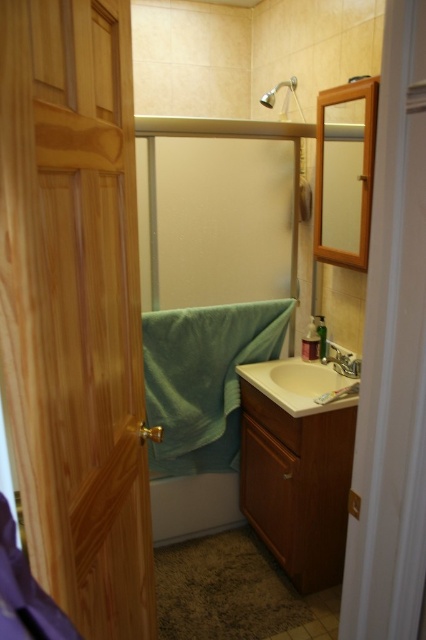
Can you confirm if green cotton towel at center is positioned below beige matte sink at center?

No, green cotton towel at center is not below beige matte sink at center.

Locate an element on the screen. The width and height of the screenshot is (426, 640). green cotton towel at center is located at coordinates (204, 380).

Is wooden framed mirror at upper right closer to camera compared to matte silver faucet at sink right?

Yes, it is in front of matte silver faucet at sink right.

Which of these two, wooden framed mirror at upper right or matte silver faucet at sink right, stands shorter?

Standing shorter between the two is matte silver faucet at sink right.

This screenshot has width=426, height=640. I want to click on wooden framed mirror at upper right, so click(345, 172).

Does point (144, 321) come farther from viewer compared to point (340, 355)?

No.

Can you confirm if green cotton towel at center is positioned above matte silver faucet at sink right?

No, green cotton towel at center is not above matte silver faucet at sink right.

Is point (189, 310) positioned behind point (321, 358)?

That is False.

The width and height of the screenshot is (426, 640). In order to click on green cotton towel at center in this screenshot , I will do tap(204, 380).